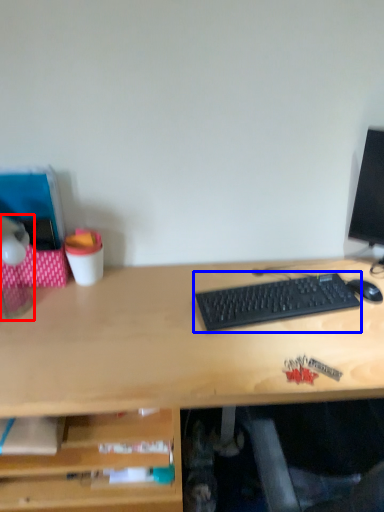
Question: Among these objects, which one is farthest to the camera, table lamp (highlighted by a red box) or computer keyboard (highlighted by a blue box)?

Choices:
 (A) table lamp
 (B) computer keyboard

Answer: (B)